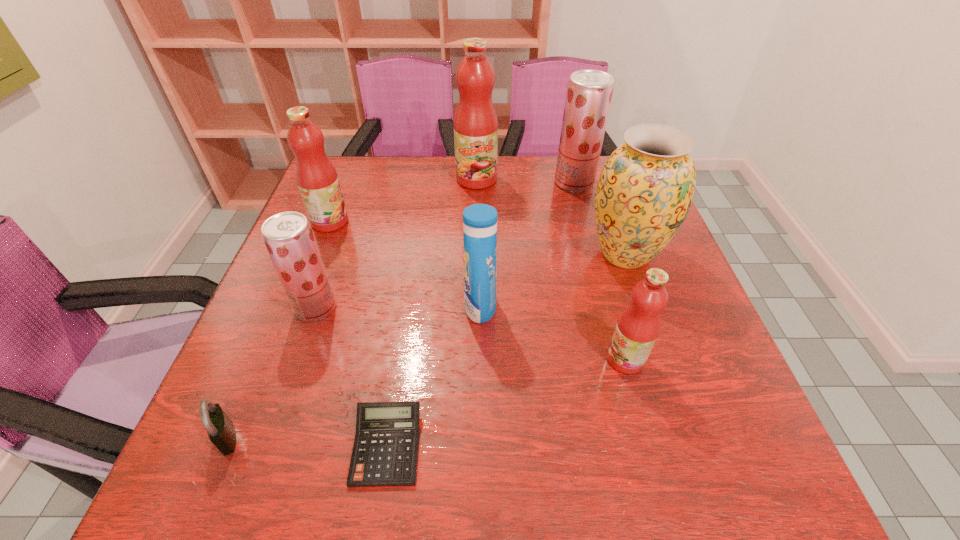
Locate an element on the screen. This screenshot has height=540, width=960. calculator present at the near edge is located at coordinates (385, 451).

Identify the location of padlock located at the left edge. (221, 431).

At what (x,y) coordinates should I click in order to perform the action: click on vase that is at the right edge. Please return your answer as a coordinate pair (x, y). Looking at the image, I should click on (646, 188).

Identify the location of object positioned at the near left corner. (221, 431).

Where is `object located at the far right corner`? This screenshot has width=960, height=540. object located at the far right corner is located at coordinates (589, 92).

The image size is (960, 540). In the image, there is a desktop. Identify the location of vacant space at the far edge. (x=490, y=188).

The width and height of the screenshot is (960, 540). In the image, there is a desktop. Identify the location of free space at the near edge. (x=445, y=480).

Identify the location of free space at the left edge of the desktop. The image size is (960, 540). (324, 239).

Image resolution: width=960 pixels, height=540 pixels. Find the location of `free space at the right edge`. free space at the right edge is located at coordinates (690, 325).

Find the location of a particular element. Image resolution: width=960 pixels, height=540 pixels. free space at the near right corner of the desktop is located at coordinates coord(705,467).